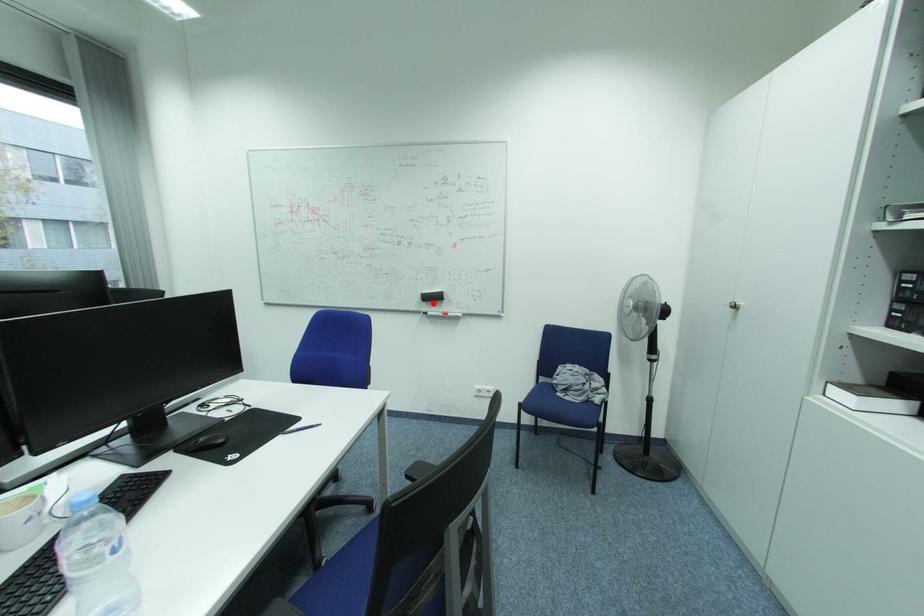
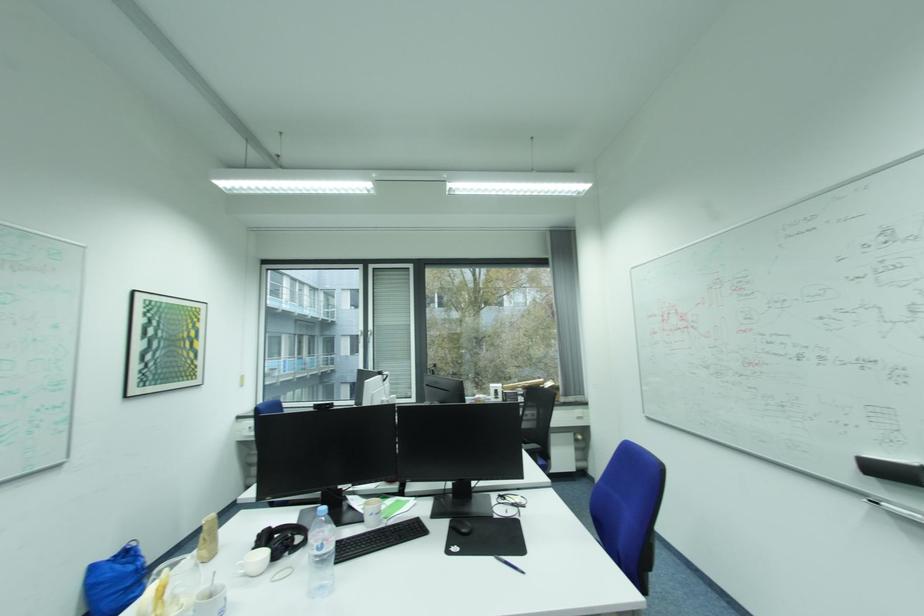
Find the pixel in the second image that matches the highlighted location in the first image.

(880, 477)